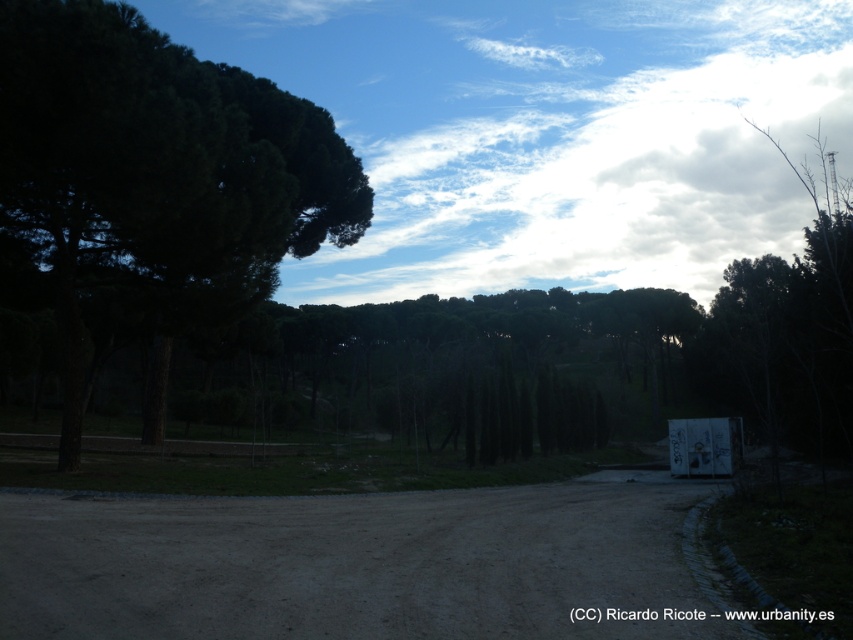
You are a hiker carrying a backpack and need to cross from the dirt track at center to the dark green textured tree at left. The path is narrow. Can you safely walk between them without getting too close to either?

The dirt track at center and dark green textured tree at left are 9.16 meters apart from each other. Since the distance is sufficient, you can safely walk between them without getting too close to either.

You are a hiker trying to follow the dirt track at center. There is a dark green textured tree at left that might block your view. Can you see the path clearly?

The dirt track at center is positioned under the dark green textured tree at left, so the tree might cast a shadow or block the view of the path depending on the time of day. Since the scene shows late afternoon or early evening sunlight, the tree could be casting a shadow over the path, making it less visible. However, the description doesn not explicitly mention shadows blocking the path, so visibility might still be possible depending on the trees position and the paths curvature.